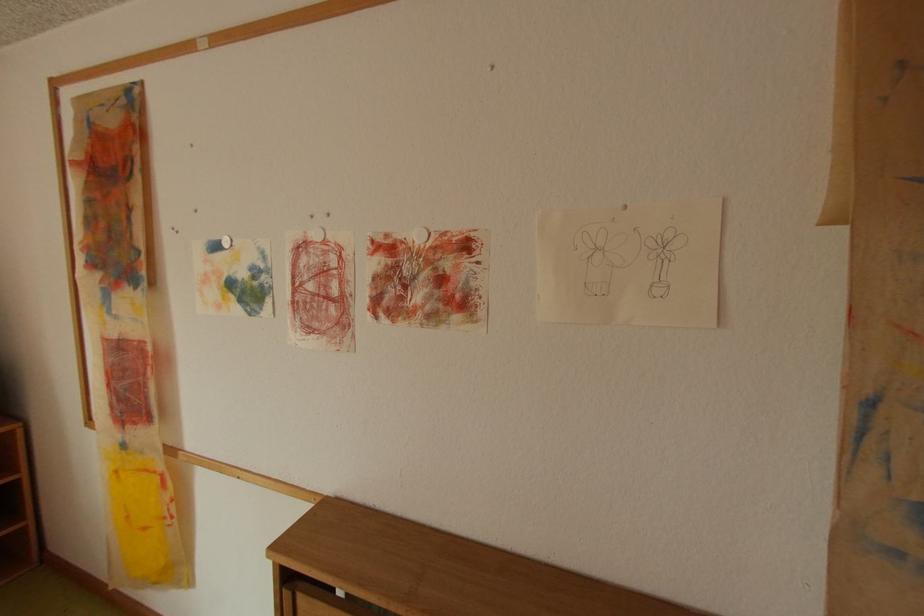
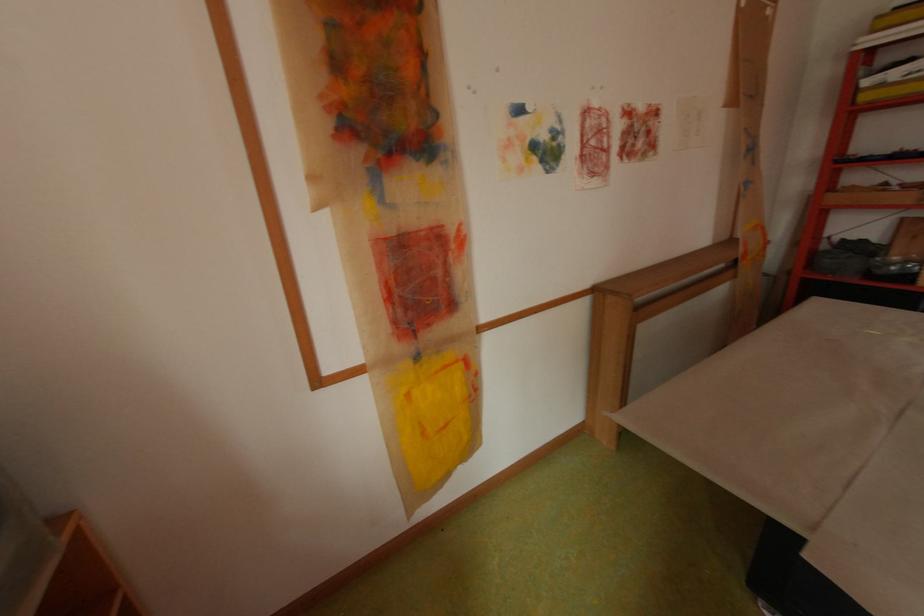
Where in the second image is the point corresponding to (134,446) from the first image?

(429, 358)